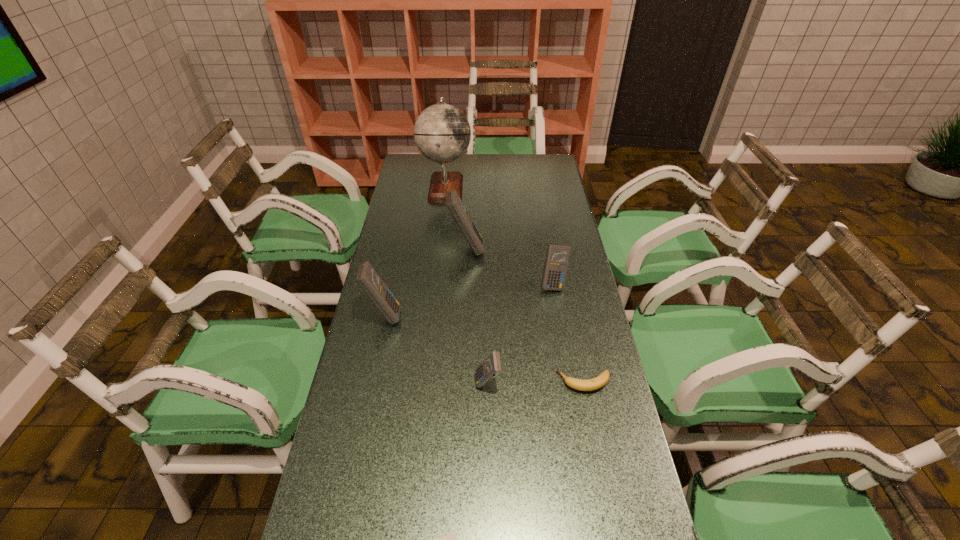
Identify the location of banana. (596, 383).

Locate an element on the screen. The width and height of the screenshot is (960, 540). the second shortest object is located at coordinates (596, 383).

You are a GUI agent. You are given a task and a screenshot of the screen. Output one action in this format:
    pyautogui.click(x=<x>, y=<y>)
    Task: Click on the vacant region located 0.150m at the equator of the globe
    
    Given the screenshot: What is the action you would take?
    pyautogui.click(x=505, y=187)

This screenshot has width=960, height=540. Identify the location of free space located on the front-facing side of the second tallest object. (530, 248).

The width and height of the screenshot is (960, 540). Find the location of `free space located 0.050m on the front-facing side of the third tallest object`. free space located 0.050m on the front-facing side of the third tallest object is located at coordinates (418, 315).

Where is `vacant region located 0.150m on the front-facing side of the second farthest blue calculator`? This screenshot has height=540, width=960. vacant region located 0.150m on the front-facing side of the second farthest blue calculator is located at coordinates (561, 328).

This screenshot has width=960, height=540. Identify the location of blank area located 0.120m on the front-facing side of the third shortest object. (432, 383).

Identify the location of vacant space situated on the front-facing side of the third shortest object. (353, 383).

The width and height of the screenshot is (960, 540). I want to click on free region located on the front-facing side of the third shortest object, so click(x=399, y=383).

The height and width of the screenshot is (540, 960). Identify the location of free region located 0.400m at the stem of the sixth tallest object. (415, 382).